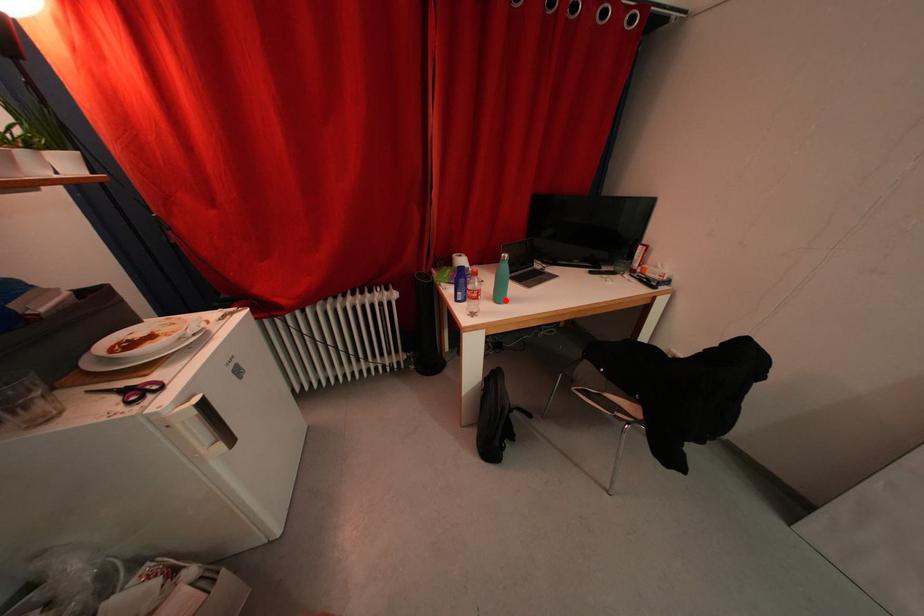
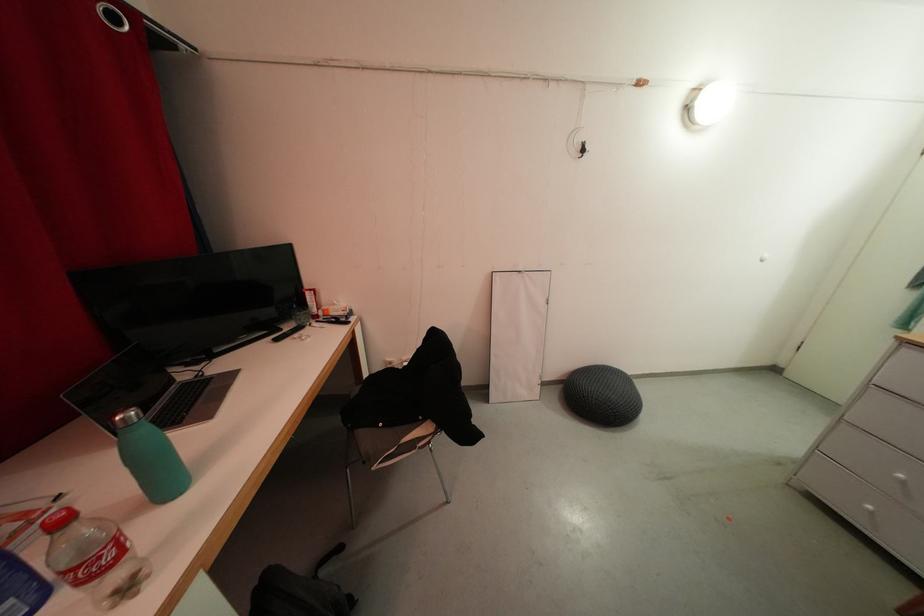
The point at the highlighted location is marked in the first image. Where is the corresponding point in the second image?

(173, 487)